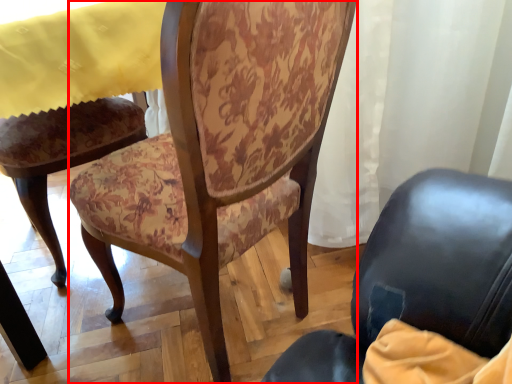
Question: Observing the image, what is the correct spatial positioning of chair (annotated by the red box) in reference to tablecloth?

Choices:
 (A) right
 (B) left

Answer: (A)